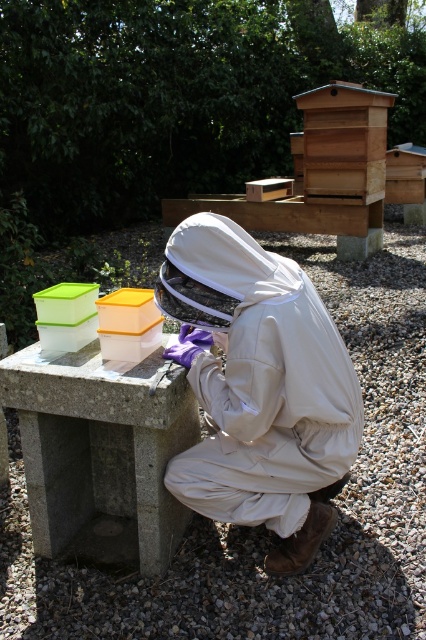
You are a visitor at a beekeeping site and see the white fabric beekeeper suit at center and the wooden beehive at upper center. Which object is located to the left of the other?

The white fabric beekeeper suit at center is positioned on the left side of wooden beehive at upper center.

You are a visitor at a beekeeping site and see the white fabric beekeeper suit at center and the wooden beehive at upper center. Which object is closer to the ground?

The white fabric beekeeper suit at center is closer to the ground because it is positioned under the wooden beehive at upper center.